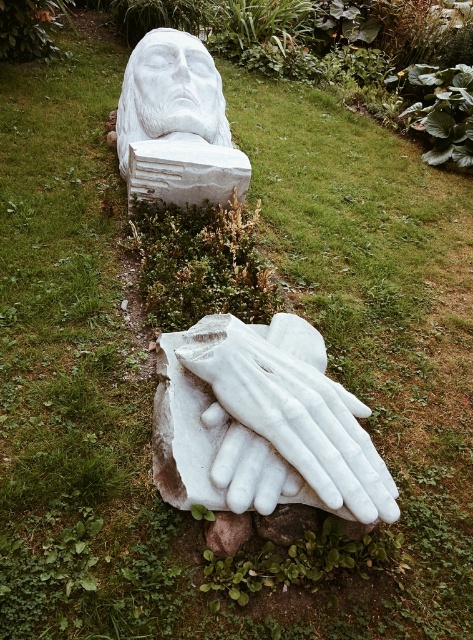
You are standing at the point with coordinates (171, 92) in the image. What object is located exactly at that point?

The white marble head at upper center is located exactly at point (171, 92).

You are an archaeologist examining the white marble head at upper center. Based on its position, can you determine if it is closer to the top or bottom edge of the image?

The white marble head at upper center is located at point coordinates approximately 0.145 on the x and 0.362 on the y axis. Since the y coordinate is closer to 0, it is positioned closer to the top edge of the image.

In the scene shown: You are standing in front of the marble sculpture and want to place a small flower at each of the two points marked on the sculpture. The first point is at coordinate point (154, 106) and the second is at point (236, 547). Which point should you place the flower closer to the front of the sculpture?

You should place the flower at point (154, 106) because it is further to the camera than point (236, 547), meaning it is closer to the front of the sculpture.